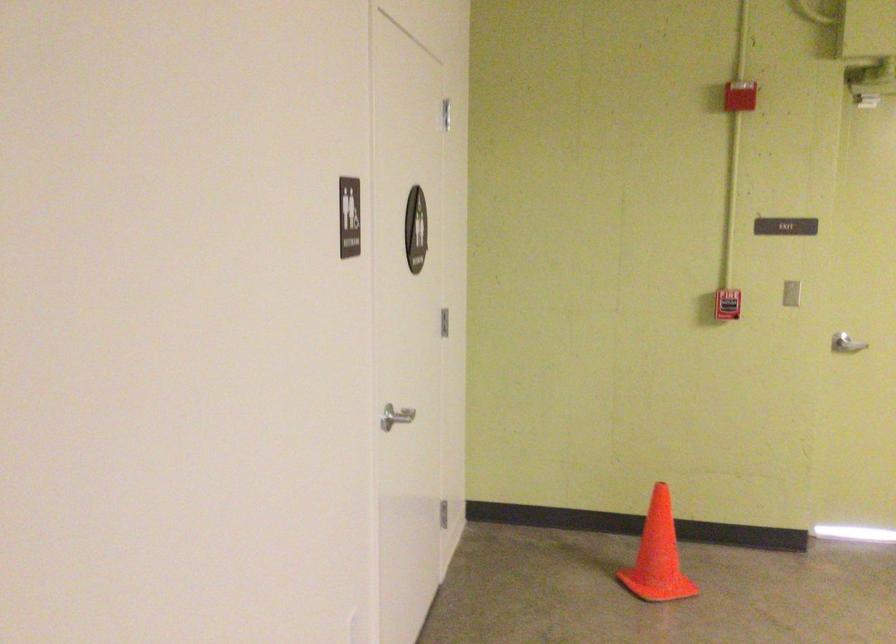
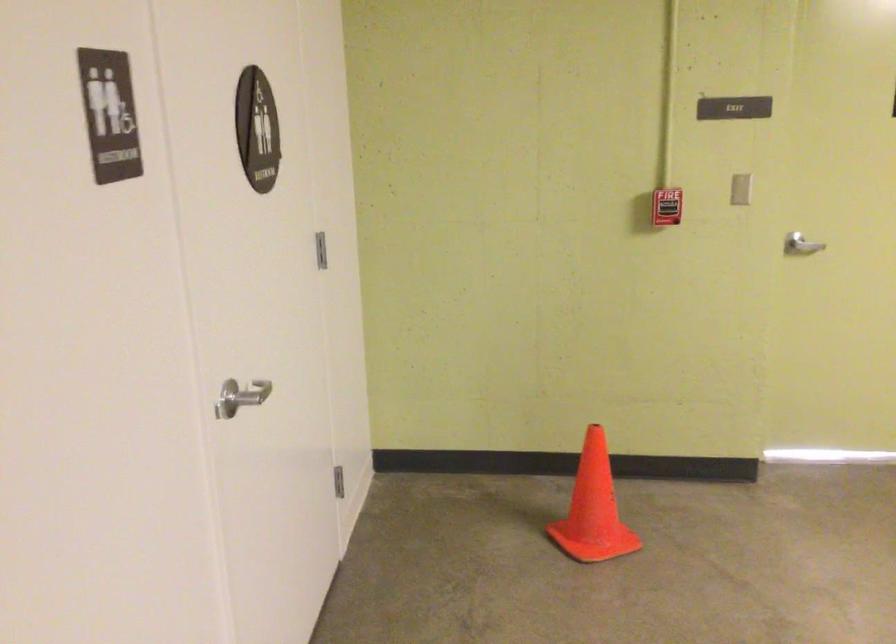
Question: Based on the continuous images, in which direction is the camera rotating? Reply with the corresponding letter.

Choices:
 (A) Left
 (B) Right
 (C) Up
 (D) Down

Answer: (D)